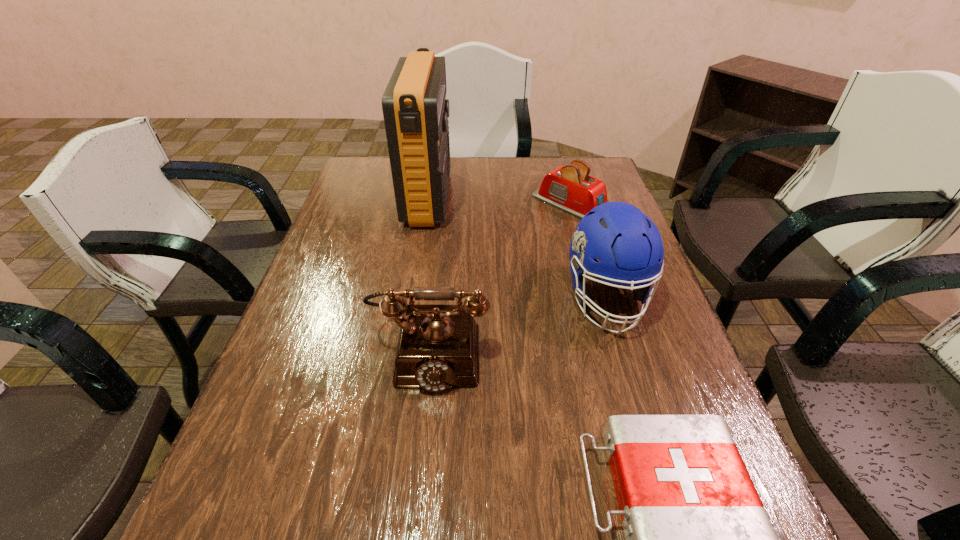
Locate an element on the screen. The height and width of the screenshot is (540, 960). empty location between the toaster and the tallest object is located at coordinates (500, 201).

Select which object is the second closest to the nearest object. Please provide its 2D coordinates. Your answer should be formatted as a tuple, i.e. [(x, y)], where the tuple contains the x and y coordinates of a point satisfying the conditions above.

[(628, 244)]

I want to click on object that stands as the fourth closest to the third tallest object, so click(x=570, y=188).

What are the coordinates of `vacant region that satisfies the following two spatial constraints: 1. on the front-facing side of the radio receiver; 2. on the right side of the fourth tallest object` in the screenshot? It's located at (427, 204).

The height and width of the screenshot is (540, 960). I want to click on blank space that satisfies the following two spatial constraints: 1. on the front-facing side of the second shortest object; 2. on the left side of the radio receiver, so click(x=427, y=204).